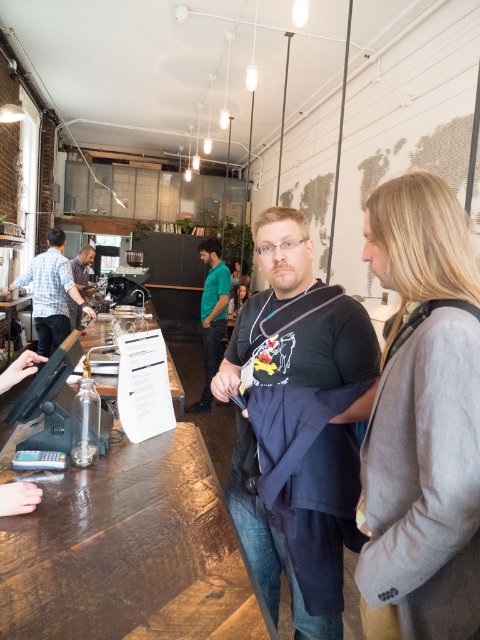
You are standing at the entrance of the coffee shop and want to walk towards the two points marked in the image. Which point, point (x=207, y=360) or point (x=80, y=272), will you reach first?

Point (x=207, y=360) is closer to the viewer than point (x=80, y=272), so you will reach point (x=207, y=360) first.

You are standing in the coffee shop and notice a point at coordinates (212, 316). What object is located at this point?

The point at coordinates (212, 316) corresponds to the green fabric shirt at center.